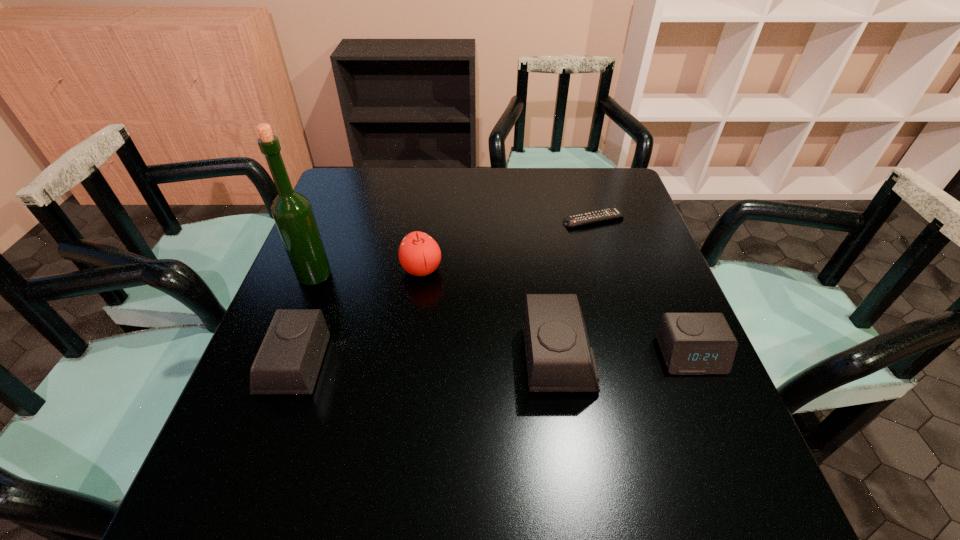
The width and height of the screenshot is (960, 540). I want to click on empty location between the rightmost alarm clock and the tallest object, so click(x=502, y=316).

Identify which object is the nearest to the apple. Please provide its 2D coordinates. Your answer should be formatted as a tuple, i.e. [(x, y)], where the tuple contains the x and y coordinates of a point satisfying the conditions above.

[(292, 212)]

The image size is (960, 540). What are the coordinates of `object that stands as the fourth closest to the apple` in the screenshot? It's located at (599, 215).

Identify which alarm clock is the second nearest to the tallest object. Please provide its 2D coordinates. Your answer should be formatted as a tuple, i.e. [(x, y)], where the tuple contains the x and y coordinates of a point satisfying the conditions above.

[(559, 358)]

The width and height of the screenshot is (960, 540). In order to click on alarm clock that is the closest to the remote control in this screenshot , I will do `click(559, 358)`.

The height and width of the screenshot is (540, 960). In order to click on vacant space that satisfies the following two spatial constraints: 1. on the front-facing side of the second shortest object; 2. on the front-facing side of the fourth object from left to right in this screenshot , I will do `click(691, 359)`.

Where is `free space in the image that satisfies the following two spatial constraints: 1. on the front-facing side of the rightmost alarm clock; 2. on the front-facing side of the leftmost alarm clock`? The width and height of the screenshot is (960, 540). free space in the image that satisfies the following two spatial constraints: 1. on the front-facing side of the rightmost alarm clock; 2. on the front-facing side of the leftmost alarm clock is located at coordinates (694, 366).